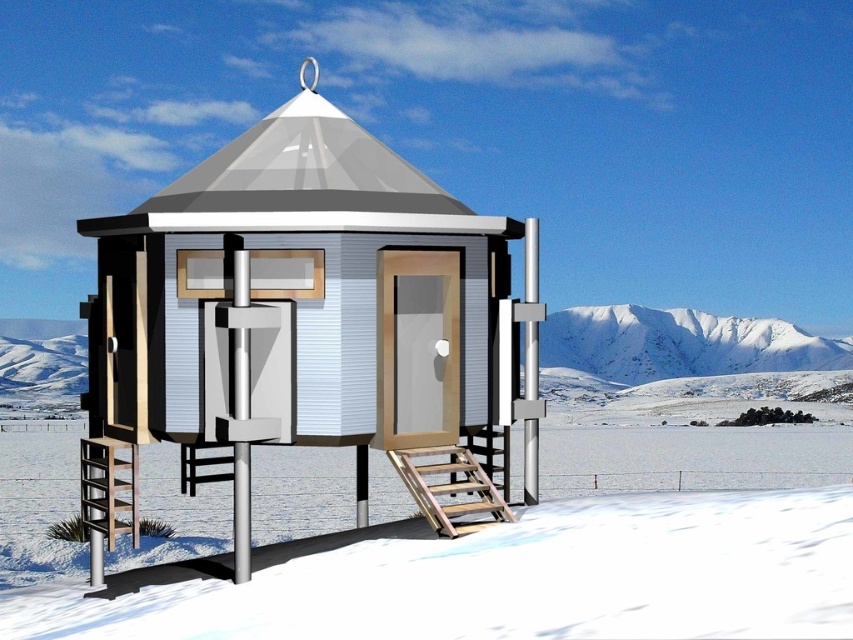
You are standing at point 0.5, 0.5 in the snowy landscape. You want to walk directly towards the white matte cabin at center. Which direction should you head?

The white matte cabin at center is located at point (x=314, y=314). Since you are at point (x=426, y=320), you should head northwest to reach it.